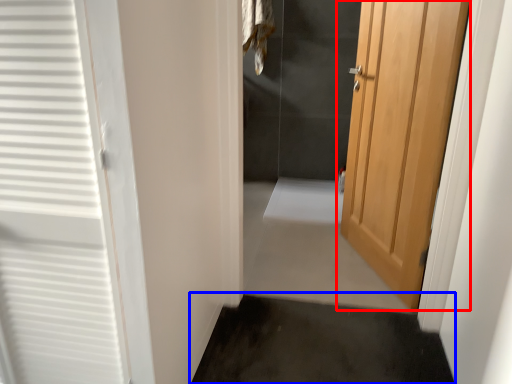
Question: Among these objects, which one is nearest to the camera, door (highlighted by a red box) or path (highlighted by a blue box)?

Choices:
 (A) door
 (B) path

Answer: (B)